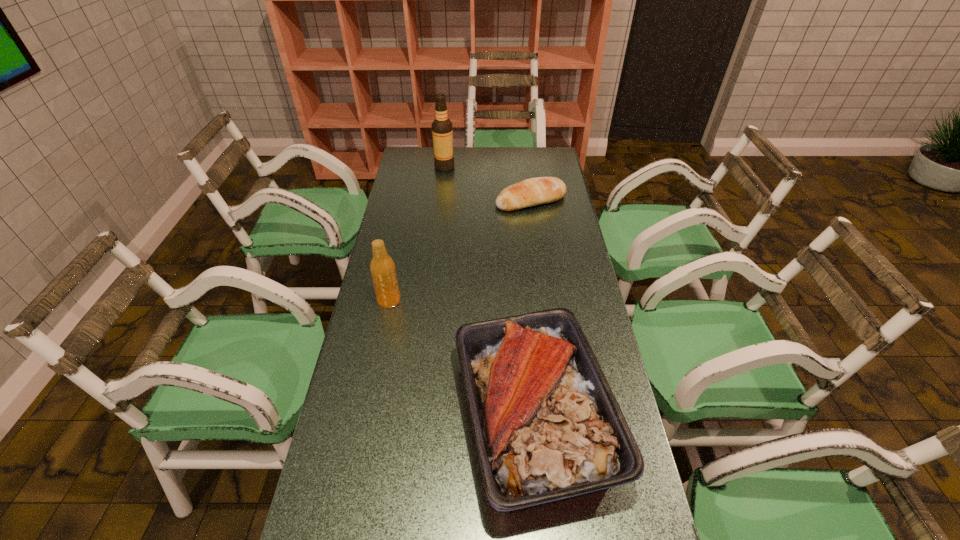
This screenshot has width=960, height=540. What are the coordinates of `free space located on the back of the tray` in the screenshot? It's located at (518, 250).

This screenshot has width=960, height=540. Identify the location of free space located 0.070m on the back of the shortest object. tap(528, 180).

Find the location of a particular element. This screenshot has width=960, height=540. object present at the far edge is located at coordinates (442, 131).

Find the location of `alcohol present at the left edge`. alcohol present at the left edge is located at coordinates pos(442,131).

The height and width of the screenshot is (540, 960). I want to click on beer bottle that is at the left edge, so click(x=382, y=267).

The width and height of the screenshot is (960, 540). Identify the location of tray that is at the right edge. (547, 426).

Where is `bread present at the right edge`? bread present at the right edge is located at coordinates (534, 191).

Where is `object present at the far left corner`? The width and height of the screenshot is (960, 540). object present at the far left corner is located at coordinates (442, 131).

Locate an element on the screen. The height and width of the screenshot is (540, 960). free space at the far edge of the desktop is located at coordinates (455, 148).

Identify the location of vacant space at the left edge of the desktop. (402, 389).